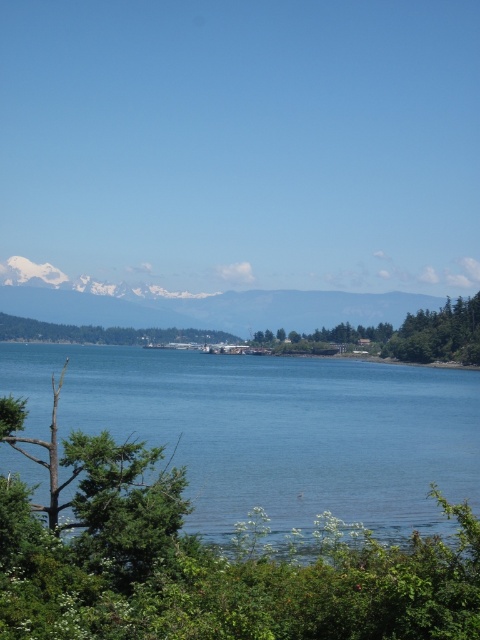
Is point (251, 330) in front of point (472, 305)?

No.

Between point (51, 321) and point (383, 324), which one is positioned behind?

Positioned behind is point (51, 321).

At what (x,y) coordinates should I click in order to perform the action: click on snowy white mountain at upper center. Please return your answer as a coordinate pair (x, y). This screenshot has height=640, width=480. Looking at the image, I should click on 213,307.

Can you confirm if blue liquid water at center is positioned to the left of snowy white mountain at upper center?

Incorrect, blue liquid water at center is not on the left side of snowy white mountain at upper center.

Is point (385, 456) positioned after point (380, 314)?

No, (385, 456) is closer to viewer.

This screenshot has width=480, height=640. Describe the element at coordinates (273, 429) in the screenshot. I see `blue liquid water at center` at that location.

The width and height of the screenshot is (480, 640). Find the location of `blue liquid water at center`. blue liquid water at center is located at coordinates (273, 429).

Is point (228, 538) positioned behind point (70, 336)?

No, (228, 538) is in front of (70, 336).

Which is more to the left, blue liquid water at center or green leafy tree at center?

From the viewer's perspective, green leafy tree at center appears more on the left side.

Is point (250, 500) more distant than point (35, 337)?

No, (250, 500) is closer to viewer.

Identify the location of blue liquid water at center. (273, 429).